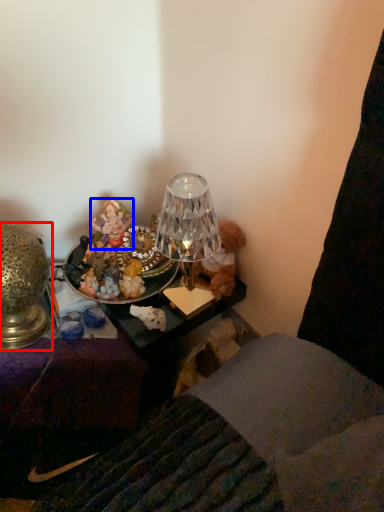
Question: Which point is closer to the camera, lamp (highlighted by a red box) or person (highlighted by a blue box)?

Choices:
 (A) lamp
 (B) person

Answer: (A)